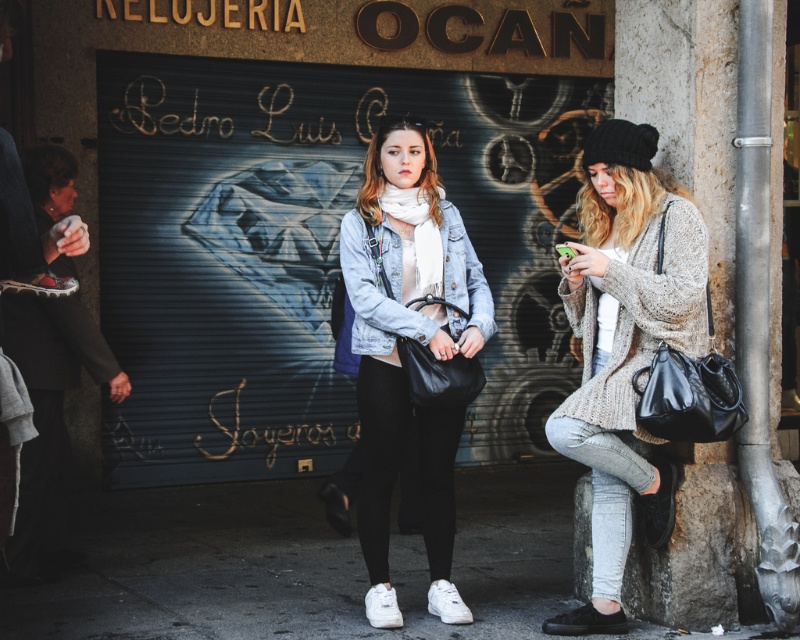
Does knitted beige sweater at right appear under denim jacket at center?

Indeed, knitted beige sweater at right is positioned under denim jacket at center.

Can you confirm if knitted beige sweater at right is positioned to the left of denim jacket at center?

In fact, knitted beige sweater at right is to the right of denim jacket at center.

Who is more distant from viewer, [617,596] or [424,292]?

The point [424,292] is more distant.

Locate an element on the screen. The height and width of the screenshot is (640, 800). knitted beige sweater at right is located at coordinates (x=624, y=346).